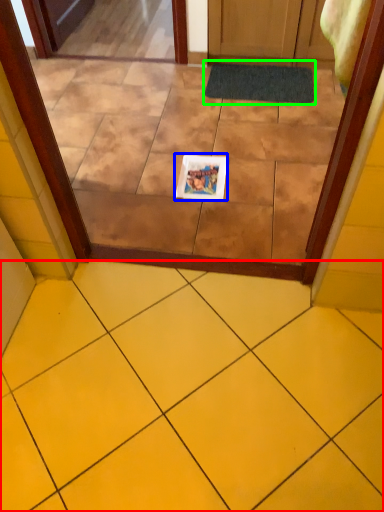
Question: Considering the real-world distances, which object is closest to ceramic tile (highlighted by a red box)? copy (highlighted by a blue box) or bath mat (highlighted by a green box).

Choices:
 (A) copy
 (B) bath mat

Answer: (A)